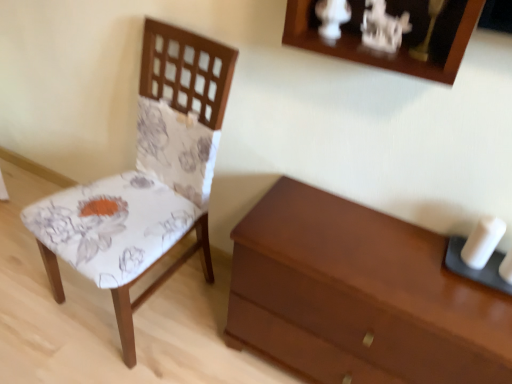
Question: Is floral fabric chair at left at the back of matte brown chest of drawers at lower right?

Choices:
 (A) yes
 (B) no

Answer: (B)

Question: Considering the relative sizes of matte brown chest of drawers at lower right and floral fabric chair at left in the image provided, is matte brown chest of drawers at lower right taller than floral fabric chair at left?

Choices:
 (A) no
 (B) yes

Answer: (A)

Question: Considering the relative positions of matte brown chest of drawers at lower right and floral fabric chair at left in the image provided, is matte brown chest of drawers at lower right in front of floral fabric chair at left?

Choices:
 (A) yes
 (B) no

Answer: (B)

Question: Is matte brown chest of drawers at lower right oriented towards floral fabric chair at left?

Choices:
 (A) no
 (B) yes

Answer: (A)

Question: Considering the relative sizes of matte brown chest of drawers at lower right and floral fabric chair at left in the image provided, is matte brown chest of drawers at lower right smaller than floral fabric chair at left?

Choices:
 (A) yes
 (B) no

Answer: (A)

Question: From a real-world perspective, is white matte candle at right positioned above or below matte brown chest of drawers at lower right?

Choices:
 (A) below
 (B) above

Answer: (B)

Question: Is white matte candle at right bigger or smaller than matte brown chest of drawers at lower right?

Choices:
 (A) small
 (B) big

Answer: (A)

Question: Considering their positions, is white matte candle at right located in front of or behind matte brown chest of drawers at lower right?

Choices:
 (A) front
 (B) behind

Answer: (B)

Question: Is point (485, 261) closer or farther from the camera than point (494, 380)?

Choices:
 (A) closer
 (B) farther

Answer: (B)

Question: Is matte brown chest of drawers at lower right bigger or smaller than white matte candle at right?

Choices:
 (A) small
 (B) big

Answer: (B)

Question: From the image's perspective, is matte brown chest of drawers at lower right located above or below white matte candle at right?

Choices:
 (A) below
 (B) above

Answer: (A)

Question: Does point pyautogui.click(x=315, y=233) appear closer or farther from the camera than point pyautogui.click(x=477, y=233)?

Choices:
 (A) closer
 (B) farther

Answer: (B)

Question: In the image, is matte brown chest of drawers at lower right positioned in front of or behind white matte candle at right?

Choices:
 (A) behind
 (B) front

Answer: (B)

Question: Would you say floral fabric chair at left is to the left or to the right of white matte candle at right in the picture?

Choices:
 (A) left
 (B) right

Answer: (A)

Question: Is floral fabric chair at left wider or thinner than white matte candle at right?

Choices:
 (A) thin
 (B) wide

Answer: (B)